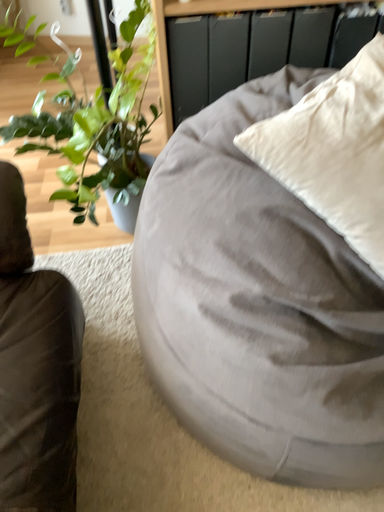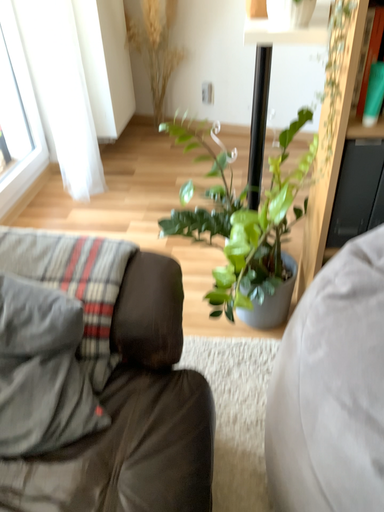
Question: Which way did the camera rotate in the video?

Choices:
 (A) rotated right
 (B) rotated left

Answer: (B)